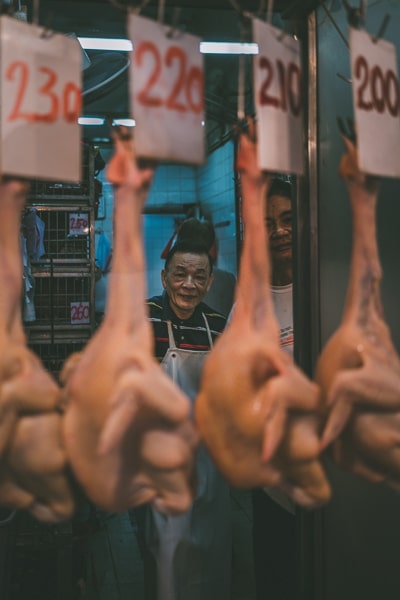
Find the location of a particular element. The width and height of the screenshot is (400, 600). light bulb is located at coordinates (88, 121).